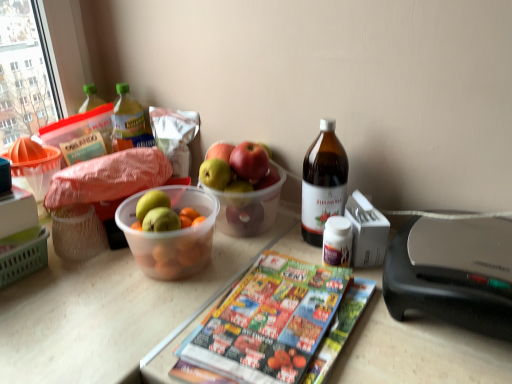
Question: In terms of height, does green matte grapefruit at center look taller or shorter compared to brown glass bottle at upper right, which ranks as the 1th bottle in front-to-back order?

Choices:
 (A) tall
 (B) short

Answer: (B)

Question: Considering their positions, is green matte grapefruit at center located in front of or behind brown glass bottle at upper right, the first bottle when ordered from right to left?

Choices:
 (A) behind
 (B) front

Answer: (A)

Question: Based on their relative distances, which object is nearer to the brown glass bottle at upper right, the second bottle positioned from the back?

Choices:
 (A) translucent plastic bottle at upper left, which ranks as the second bottle in bottom-to-top order
 (B) green matte grapefruit at center
 (C) printed paper magazine at center

Answer: (B)

Question: Which object is the closest to the translucent plastic bottle at upper left, which is the second bottle from front to back?

Choices:
 (A) printed paper magazine at center
 (B) brown glass bottle at upper right, which ranks as the 1th bottle in front-to-back order
 (C) green matte grapefruit at center

Answer: (C)